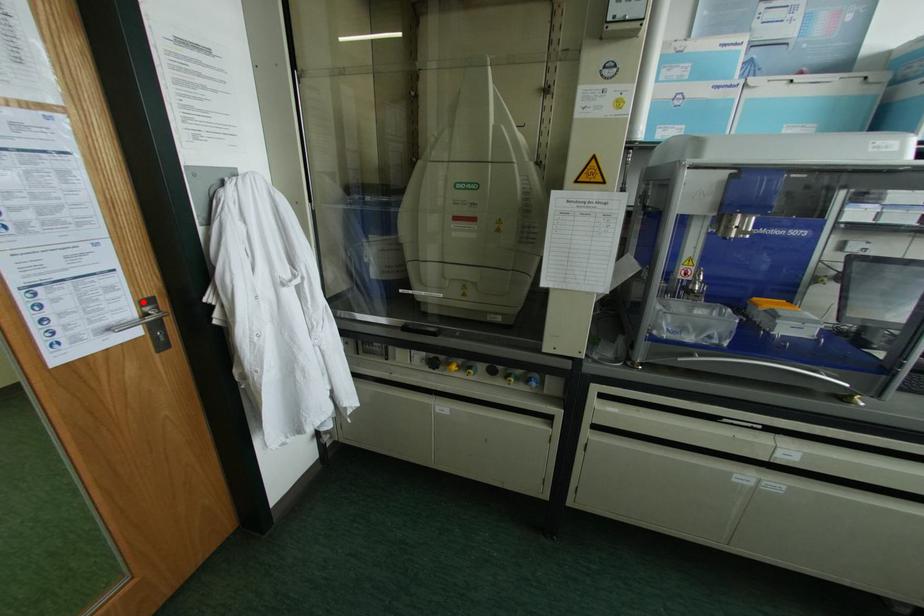
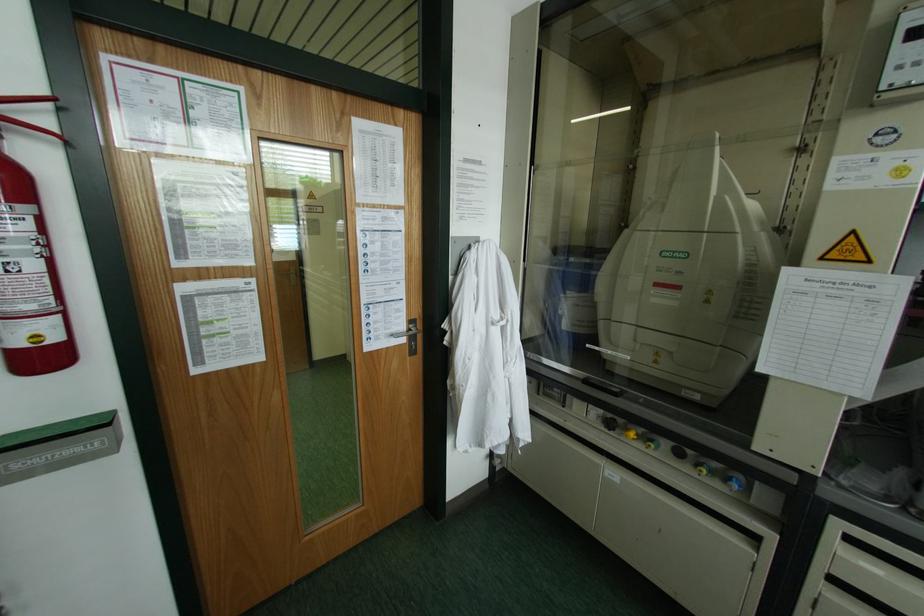
Locate, in the second image, the point that corresponds to the highlighted location in the first image.

(409, 321)